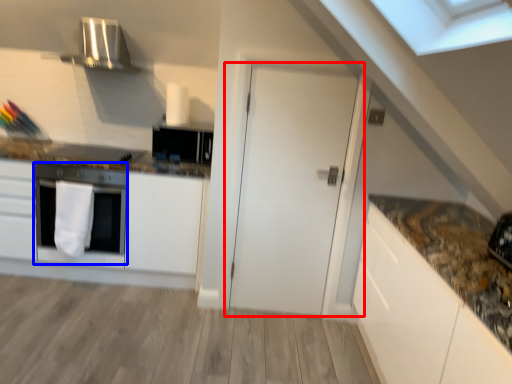
Question: Which of the following is the farthest to the observer, door (highlighted by a red box) or oven (highlighted by a blue box)?

Choices:
 (A) door
 (B) oven

Answer: (B)